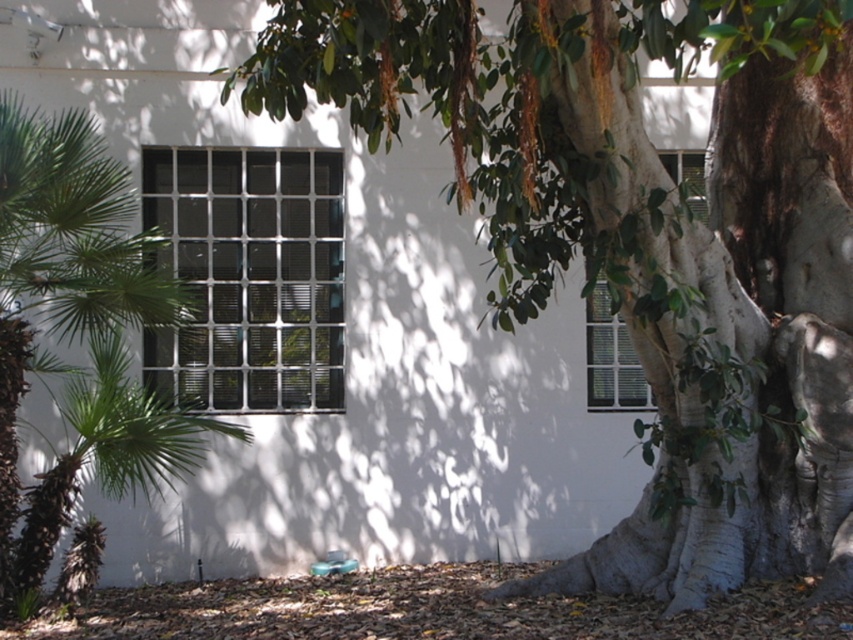
You are a painter standing in front of the white wall with windows. You want to paint the green leafy palm tree at left and the white matte window at center. Which object should you focus on first if you want to paint the one closer to you?

The green leafy palm tree at left is in front of the white matte window at center, so you should focus on painting the green leafy palm tree at left first as it is closer to you.

Looking at this image, you are standing in the outdoor scene and want to place a small decorative item between the two points labeled as point (834, 184) and point (637, 388). Based on their positions, which point should the item be closer to in order to be in front of the other?

The item should be closer to point (834, 184) because it is in front of point (637, 388).